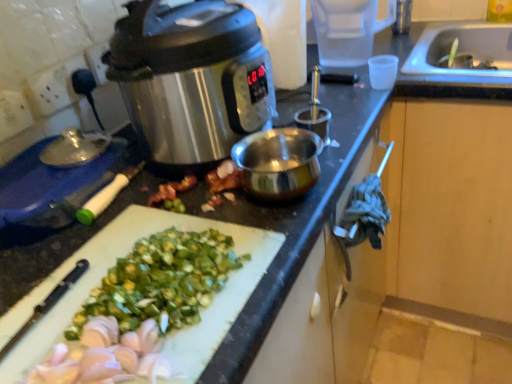
Question: Does transparent plastic cup at upper right have a lesser height compared to white plastic cutting board at lower left?

Choices:
 (A) no
 (B) yes

Answer: (A)

Question: From a real-world perspective, is transparent plastic cup at upper right positioned over white plastic cutting board at lower left based on gravity?

Choices:
 (A) yes
 (B) no

Answer: (A)

Question: Does transparent plastic cup at upper right turn towards white plastic cutting board at lower left?

Choices:
 (A) yes
 (B) no

Answer: (B)

Question: Is the position of transparent plastic cup at upper right less distant than that of white plastic cutting board at lower left?

Choices:
 (A) yes
 (B) no

Answer: (B)

Question: Is transparent plastic cup at upper right positioned far away from white plastic cutting board at lower left?

Choices:
 (A) no
 (B) yes

Answer: (A)

Question: Can you confirm if transparent plastic cup at upper right is positioned to the right of white plastic cutting board at lower left?

Choices:
 (A) yes
 (B) no

Answer: (A)

Question: Is stainless steel slow cooker at upper left located outside transparent plastic cup at upper right?

Choices:
 (A) no
 (B) yes

Answer: (B)

Question: Is stainless steel slow cooker at upper left positioned in front of transparent plastic cup at upper right?

Choices:
 (A) no
 (B) yes

Answer: (B)

Question: Is stainless steel slow cooker at upper left beside transparent plastic cup at upper right?

Choices:
 (A) no
 (B) yes

Answer: (A)

Question: Can you confirm if stainless steel slow cooker at upper left is shorter than transparent plastic cup at upper right?

Choices:
 (A) no
 (B) yes

Answer: (A)

Question: Considering the relative positions of stainless steel slow cooker at upper left and transparent plastic cup at upper right in the image provided, is stainless steel slow cooker at upper left behind transparent plastic cup at upper right?

Choices:
 (A) no
 (B) yes

Answer: (A)

Question: Would you consider stainless steel slow cooker at upper left to be distant from transparent plastic cup at upper right?

Choices:
 (A) no
 (B) yes

Answer: (A)

Question: Can you confirm if white plastic cutting board at lower left is wider than stainless steel slow cooker at upper left?

Choices:
 (A) no
 (B) yes

Answer: (A)